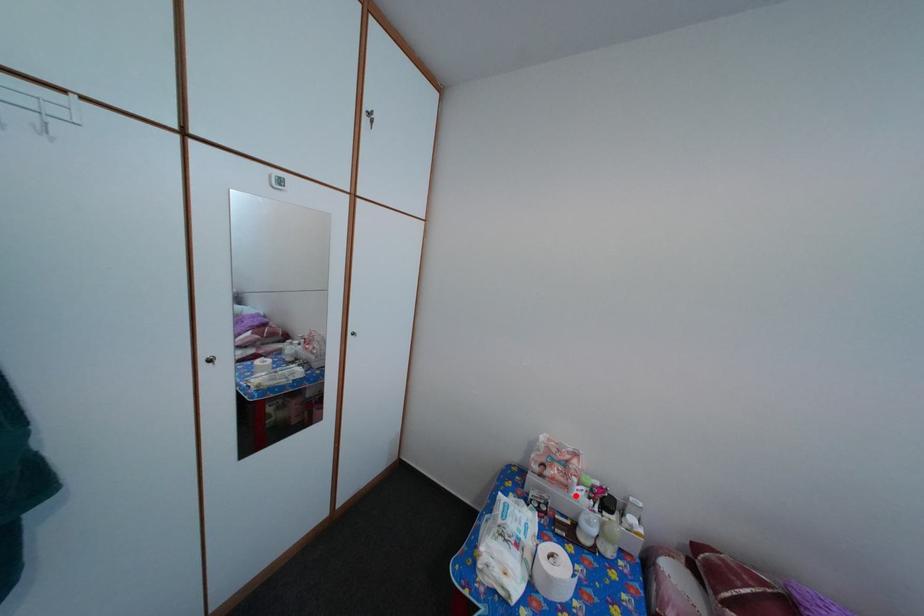
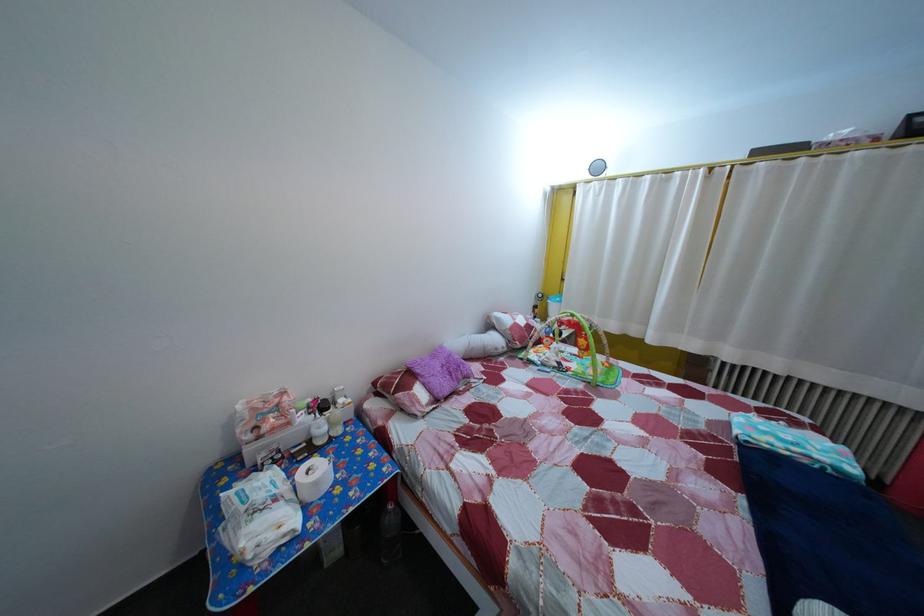
Locate, in the second image, the point that corresponds to the highlighted location in the first image.

(298, 432)